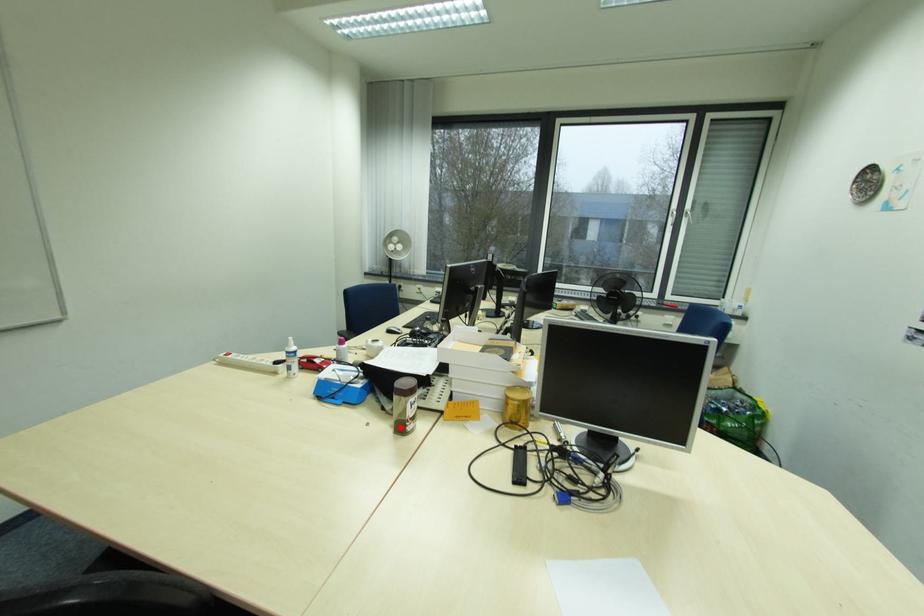
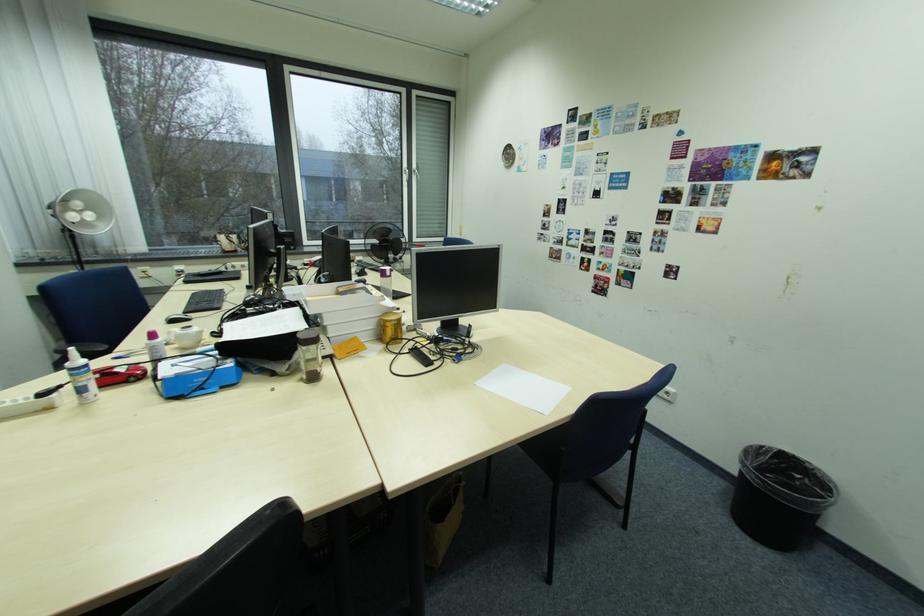
Question: I am providing you with two images of the same scene from different viewpoints. Image1 has a red point marked. In image2, the corresponding 3D location appears at what relative position? Reply with the corresponding letter.

Choices:
 (A) Closer
 (B) Farther

Answer: (A)